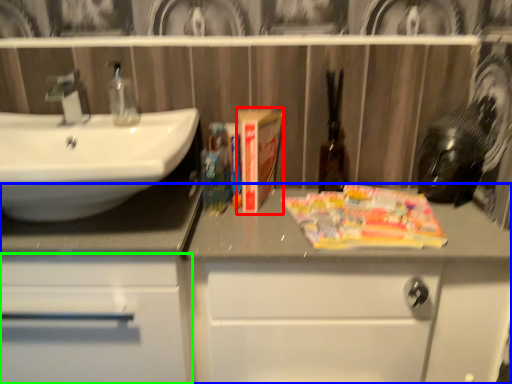
Question: Estimate the real-world distances between objects in this image. Which object is closer to paperback book (highlighted by a red box), bathroom cabinet (highlighted by a blue box) or bathroom cabinet (highlighted by a green box)?

Choices:
 (A) bathroom cabinet
 (B) bathroom cabinet

Answer: (A)